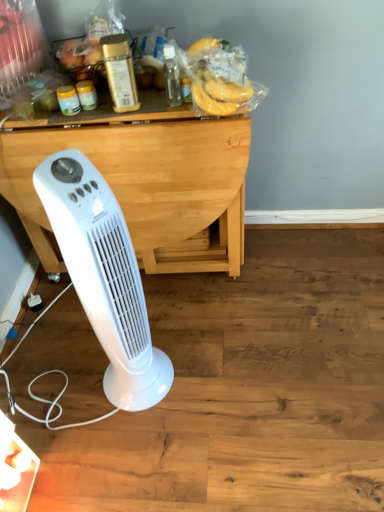
Find the location of `free space between yellow matte bananas at upper center and gold metallic container at upper center, the first bottle positioned from the left`. free space between yellow matte bananas at upper center and gold metallic container at upper center, the first bottle positioned from the left is located at coordinates (160, 110).